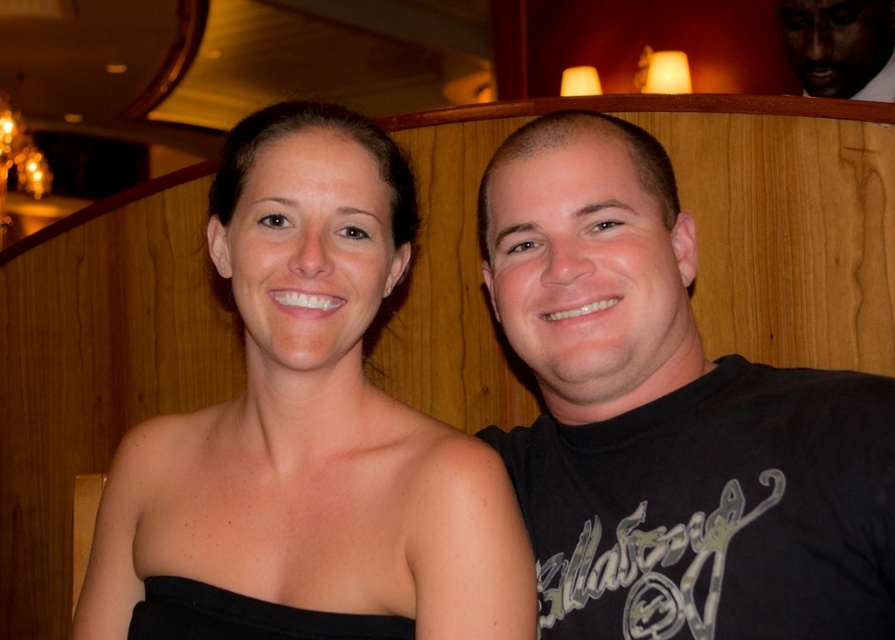
Question: Can you confirm if black matte shirt at right is positioned to the right of dark skin smooth face at upper right?

Choices:
 (A) yes
 (B) no

Answer: (B)

Question: Can you confirm if black matte shirt at right is thinner than dark skin smooth face at upper right?

Choices:
 (A) no
 (B) yes

Answer: (A)

Question: Which of the following is the farthest from the observer?

Choices:
 (A) black matte dress at center
 (B) dark skin smooth face at upper right

Answer: (B)

Question: Which of the following is the farthest from the observer?

Choices:
 (A) (859, 19)
 (B) (297, 476)
 (C) (508, 291)

Answer: (A)

Question: Which point appears closest to the camera in this image?

Choices:
 (A) (142, 513)
 (B) (842, 518)

Answer: (B)

Question: From the image, what is the correct spatial relationship of black matte shirt at right in relation to dark skin smooth face at upper right?

Choices:
 (A) right
 (B) left

Answer: (B)